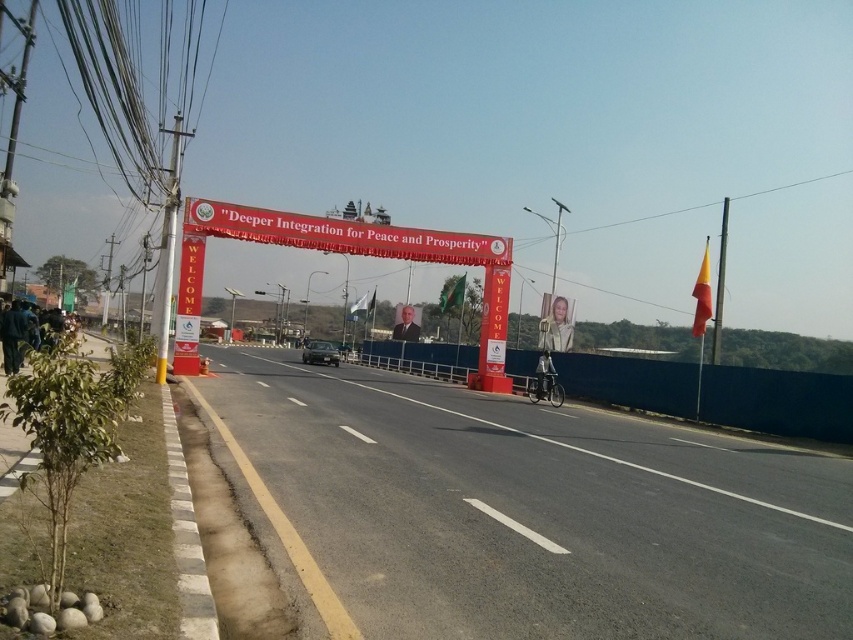
Question: Which of the following is the farthest from the observer?

Choices:
 (A) (839, 376)
 (B) (305, 349)

Answer: (B)

Question: Is blue concrete barrier at center to the left of red fabric banner at center from the viewer's perspective?

Choices:
 (A) no
 (B) yes

Answer: (A)

Question: Which object appears farthest from the camera in this image?

Choices:
 (A) blue concrete barrier at center
 (B) red fabric banner at center
 (C) shiny black car at center

Answer: (C)

Question: Is blue concrete barrier at center above red fabric banner at center?

Choices:
 (A) no
 (B) yes

Answer: (A)

Question: Is blue concrete barrier at center thinner than red fabric banner at center?

Choices:
 (A) no
 (B) yes

Answer: (A)

Question: Which object appears farthest from the camera in this image?

Choices:
 (A) shiny black car at center
 (B) red fabric banner at center
 (C) blue concrete barrier at center

Answer: (A)